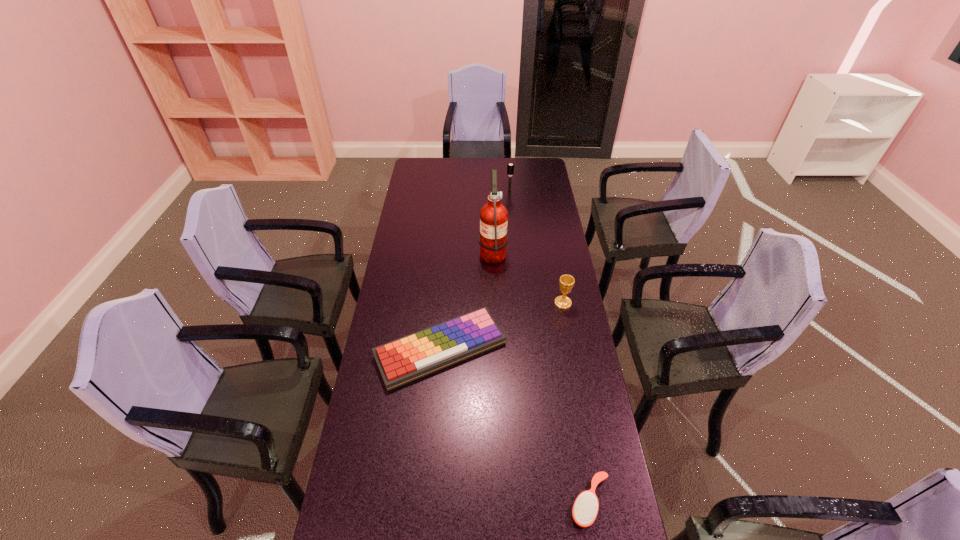
I want to click on free space at the right edge of the desktop, so click(550, 343).

In the image, there is a desktop. In order to click on vacant space at the far left corner in this screenshot , I will do `click(413, 171)`.

The width and height of the screenshot is (960, 540). Find the location of `free spot between the second farthest object and the nearest object`. free spot between the second farthest object and the nearest object is located at coordinates click(x=541, y=376).

I want to click on vacant space that is in between the tallest object and the nearer hairbrush, so click(x=541, y=376).

Image resolution: width=960 pixels, height=540 pixels. I want to click on vacant point located between the second farthest object and the computer keyboard, so click(467, 300).

Identify the location of vacant area between the fourth farthest object and the fire extinguisher. (467, 300).

Where is `free spot between the left hairbrush and the nearest object`? The height and width of the screenshot is (540, 960). free spot between the left hairbrush and the nearest object is located at coordinates (550, 345).

Locate an element on the screen. Image resolution: width=960 pixels, height=540 pixels. free space between the computer keyboard and the third object from right to left is located at coordinates (475, 269).

The height and width of the screenshot is (540, 960). I want to click on blank region between the second nearest object and the chalice, so click(502, 326).

The image size is (960, 540). I want to click on free space between the second nearest object and the third nearest object, so click(x=502, y=326).